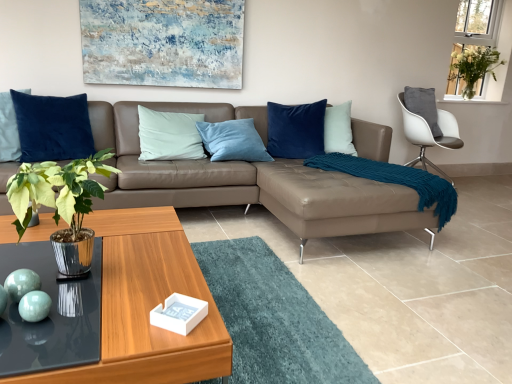
Locate an element on the screen. This screenshot has width=512, height=384. vacant area on the back side of teal glossy sphere at lower left, which appears as the first teal when viewed from the right is located at coordinates (77, 288).